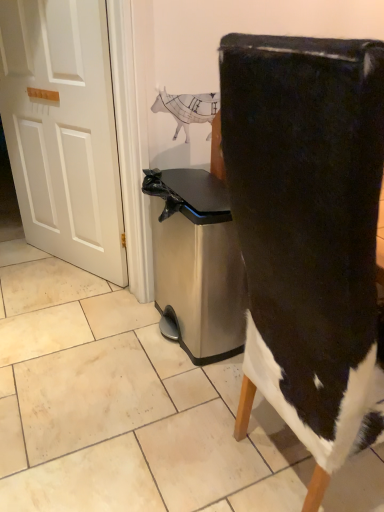
The width and height of the screenshot is (384, 512). What do you see at coordinates (308, 233) in the screenshot?
I see `black suede chair at center` at bounding box center [308, 233].

Where is `stainless steel trash can at center`? The width and height of the screenshot is (384, 512). stainless steel trash can at center is located at coordinates tap(197, 261).

Is stainless steel trash can at center closer to camera compared to black suede chair at center?

That is False.

Does stainless steel trash can at center have a lesser height compared to black suede chair at center?

Correct, stainless steel trash can at center is not as tall as black suede chair at center.

From a real-world perspective, is stainless steel trash can at center on black suede chair at center?

No, from a real-world perspective, stainless steel trash can at center is not above black suede chair at center.

Is stainless steel trash can at center facing towards black suede chair at center?

No, stainless steel trash can at center is not turned towards black suede chair at center.

Is black suede chair at center bigger than stainless steel trash can at center?

Correct, black suede chair at center is larger in size than stainless steel trash can at center.

Considering the positions of point (314, 334) and point (196, 217), is point (314, 334) closer or farther from the camera than point (196, 217)?

Point (314, 334) is closer to the camera than point (196, 217).

Does black suede chair at center contain stainless steel trash can at center?

Actually, stainless steel trash can at center is outside black suede chair at center.

Which object is further away from the camera taking this photo, black suede chair at center or stainless steel trash can at center?

stainless steel trash can at center is more distant.

How many degrees apart are the facing directions of black suede chair at center and white matte door at left?

152 degrees separate the facing orientations of black suede chair at center and white matte door at left.

Can you confirm if black suede chair at center is positioned to the left of white matte door at left?

No.

Is black suede chair at center far away from white matte door at left?

Indeed, black suede chair at center is not near white matte door at left.

You are a GUI agent. You are given a task and a screenshot of the screen. Output one action in this format:
    pyautogui.click(x=<x>, y=<y>)
    Task: Click on the door above the stainless steel trash can at center (from the image's perspective)
    The width and height of the screenshot is (384, 512).
    Given the screenshot: What is the action you would take?
    pyautogui.click(x=63, y=131)

Can we say stainless steel trash can at center lies outside white matte door at left?

stainless steel trash can at center is positioned outside white matte door at left.

Is stainless steel trash can at center positioned with its back to white matte door at left?

No, stainless steel trash can at center is not facing the opposite direction of white matte door at left.

From a real-world perspective, between stainless steel trash can at center and white matte door at left, who is vertically higher?

From a 3D spatial view, white matte door at left is above.

Does white matte door at left have a larger size compared to black suede chair at center?

No.

Looking at this image, based on their positions, is white matte door at left located to the left or right of black suede chair at center?

white matte door at left is positioned on black suede chair at center's left side.

Which of these two, white matte door at left or black suede chair at center, stands taller?

With more height is white matte door at left.

Is white matte door at left further to the viewer compared to black suede chair at center?

Yes, white matte door at left is further from the camera.

Is white matte door at left bigger than stainless steel trash can at center?

No, white matte door at left is not bigger than stainless steel trash can at center.

Is the depth of white matte door at left greater than that of stainless steel trash can at center?

Yes, it is behind stainless steel trash can at center.

Would you say white matte door at left is a long distance from stainless steel trash can at center?

No, white matte door at left is not far from stainless steel trash can at center.

Considering the sizes of objects white matte door at left and stainless steel trash can at center in the image provided, who is wider, white matte door at left or stainless steel trash can at center?

Wider between the two is stainless steel trash can at center.

The width and height of the screenshot is (384, 512). What are the coordinates of `chair above the stainless steel trash can at center (from a real-world perspective)` in the screenshot? It's located at (308, 233).

The height and width of the screenshot is (512, 384). In order to click on dish washer below the black suede chair at center (from a real-world perspective) in this screenshot , I will do `click(197, 261)`.

Looking at this image, which object lies nearer to the anchor point stainless steel trash can at center, black suede chair at center or white matte door at left?

white matte door at left.

From the image, which object appears to be nearer to black suede chair at center, stainless steel trash can at center or white matte door at left?

stainless steel trash can at center is positioned closer to the anchor black suede chair at center.

When comparing their distances from black suede chair at center, does white matte door at left or stainless steel trash can at center seem closer?

stainless steel trash can at center is positioned closer to the anchor black suede chair at center.

Looking at the image, which one is located further to white matte door at left, black suede chair at center or stainless steel trash can at center?

black suede chair at center is further to white matte door at left.

Based on the photo, when comparing their distances from stainless steel trash can at center, does white matte door at left or black suede chair at center seem further?

black suede chair at center.

Which object lies nearer to the anchor point white matte door at left, stainless steel trash can at center or black suede chair at center?

stainless steel trash can at center.

Identify the location of dish washer between white matte door at left and black suede chair at center. (197, 261).